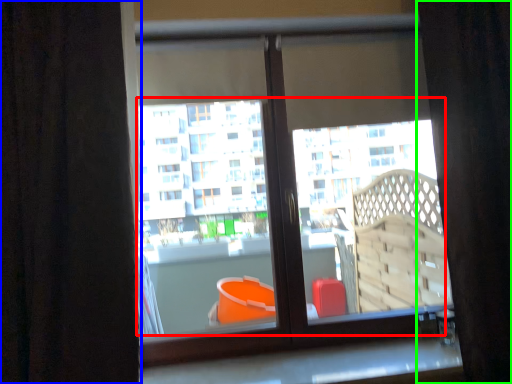
Question: Which object is the farthest from bay window (highlighted by a red box)? Choose among these: curtain (highlighted by a blue box) or curtain (highlighted by a green box).

Choices:
 (A) curtain
 (B) curtain

Answer: (A)